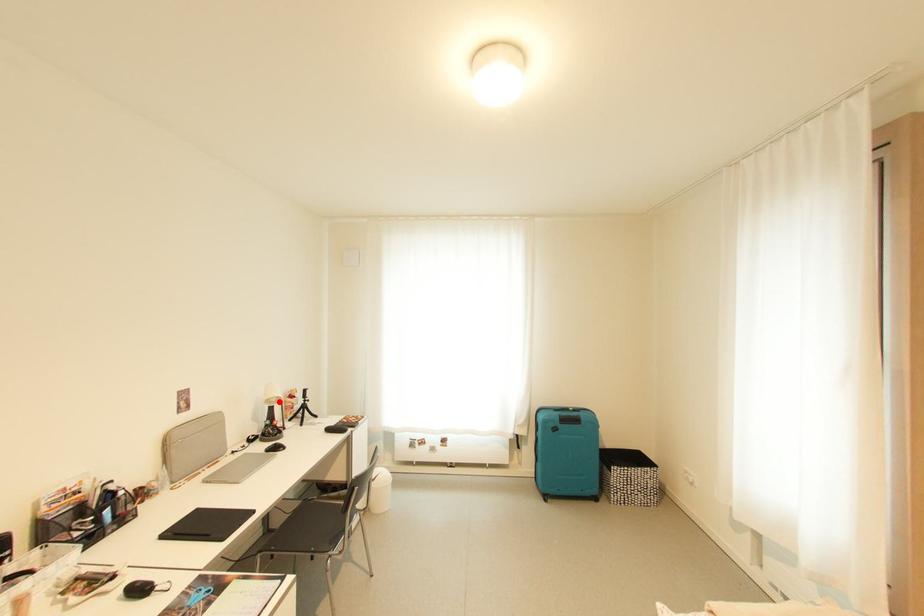
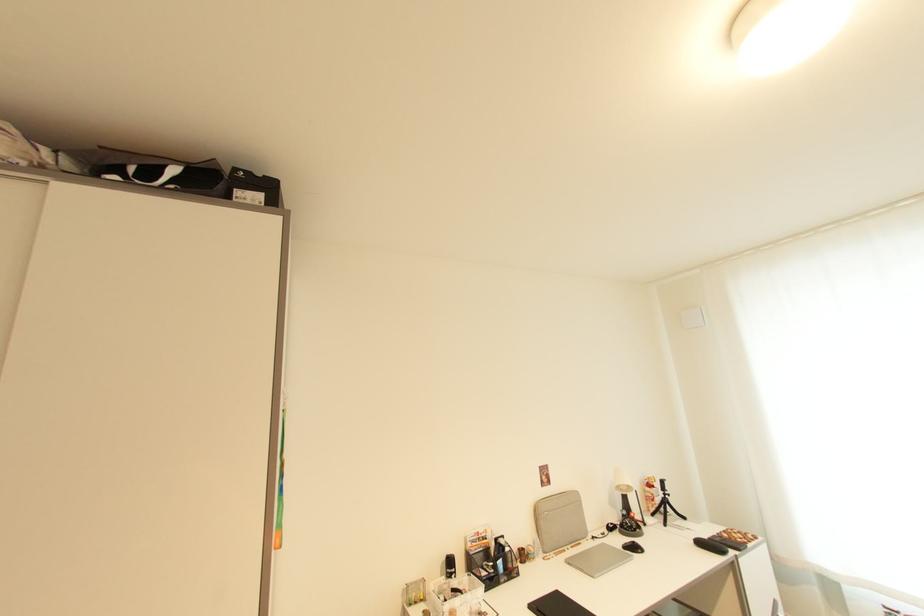
Where in the second image is the point corresponding to the highlighted location from the first image?

(629, 490)